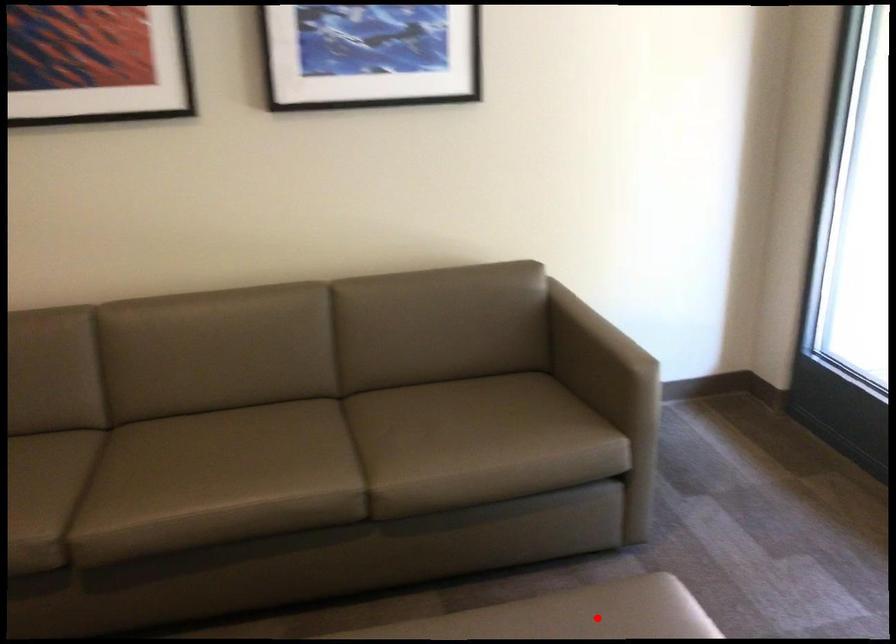
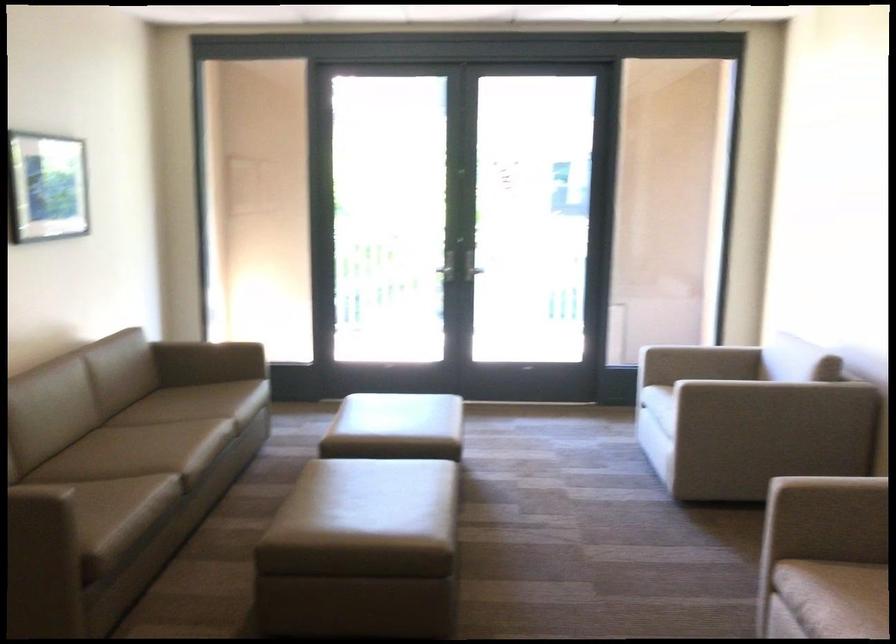
Question: I am providing you with two images of the same scene from different viewpoints. Given a red point in image1, look at the same physical point in image2. Is it:

Choices:
 (A) Closer to the viewpoint
 (B) Farther from the viewpoint

Answer: (B)